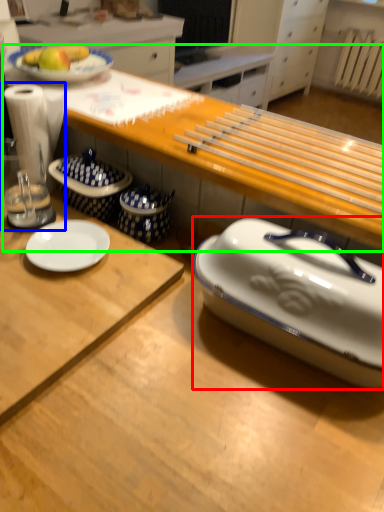
Question: Estimate the real-world distances between objects in this image. Which object is closer to tableware (highlighted by a red box), blender (highlighted by a blue box) or table (highlighted by a green box)?

Choices:
 (A) blender
 (B) table

Answer: (B)